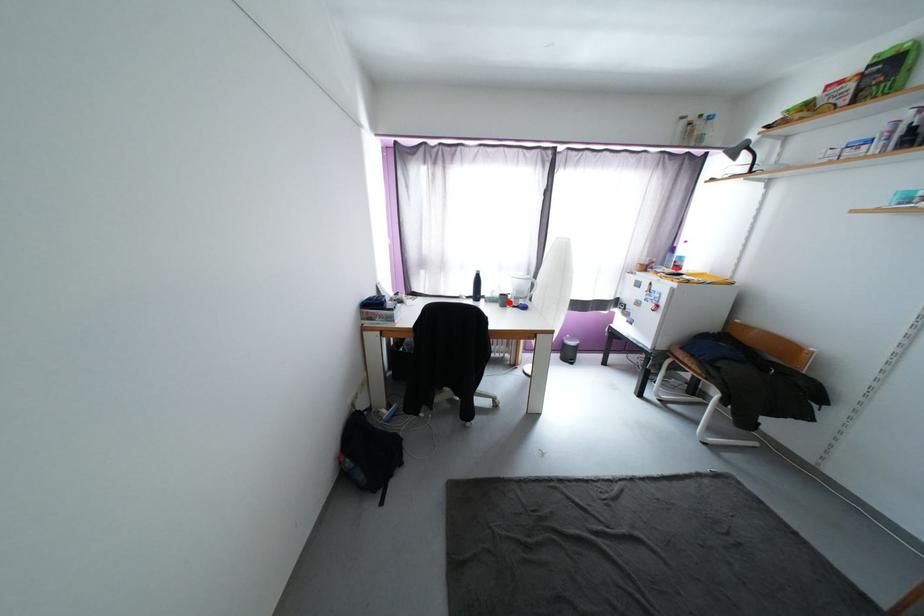
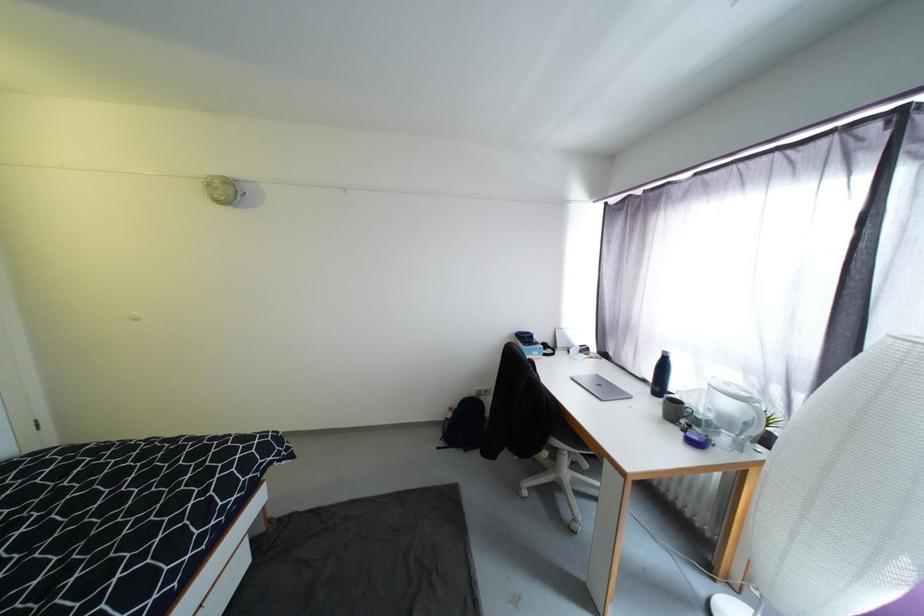
The point at the highlighted location is marked in the first image. Where is the corresponding point in the second image?

(683, 413)